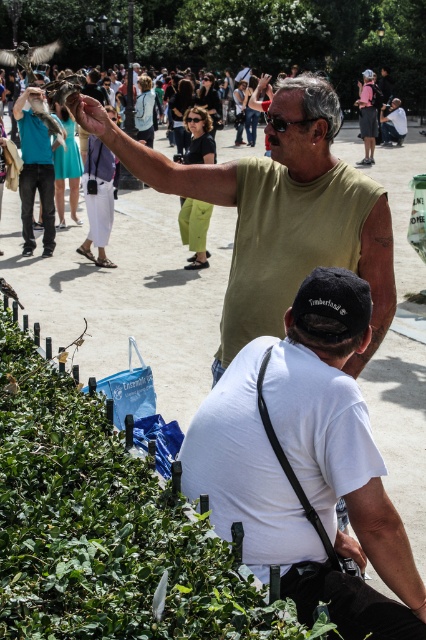
Question: Which point is closer to the camera?

Choices:
 (A) (37, 163)
 (B) (368, 244)
 (C) (17, 531)
 (D) (206, 416)

Answer: (C)

Question: Which of the following is the farthest from the observer?

Choices:
 (A) green matte tank top at upper center
 (B) green leafy hedge at lower left
 (C) white matte shirt at lower center
 (D) matte black shirt at upper center

Answer: (D)

Question: Is the position of green matte tank top at upper center less distant than that of matte black shirt at upper center?

Choices:
 (A) yes
 (B) no

Answer: (A)

Question: Which is nearer to the white matte shirt at lower center?

Choices:
 (A) green leafy hedge at lower left
 (B) green matte tank top at upper center
 (C) matte black shirt at upper center

Answer: (A)

Question: Is green leafy hedge at lower left bigger than matte black shirt at upper center?

Choices:
 (A) no
 (B) yes

Answer: (B)

Question: Is green leafy hedge at lower left positioned behind white matte shirt at lower center?

Choices:
 (A) no
 (B) yes

Answer: (A)